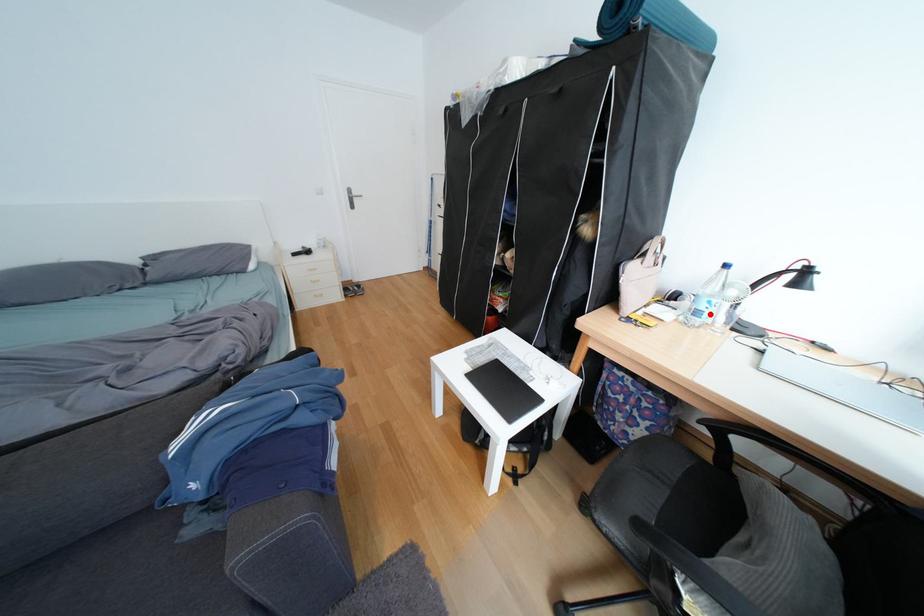
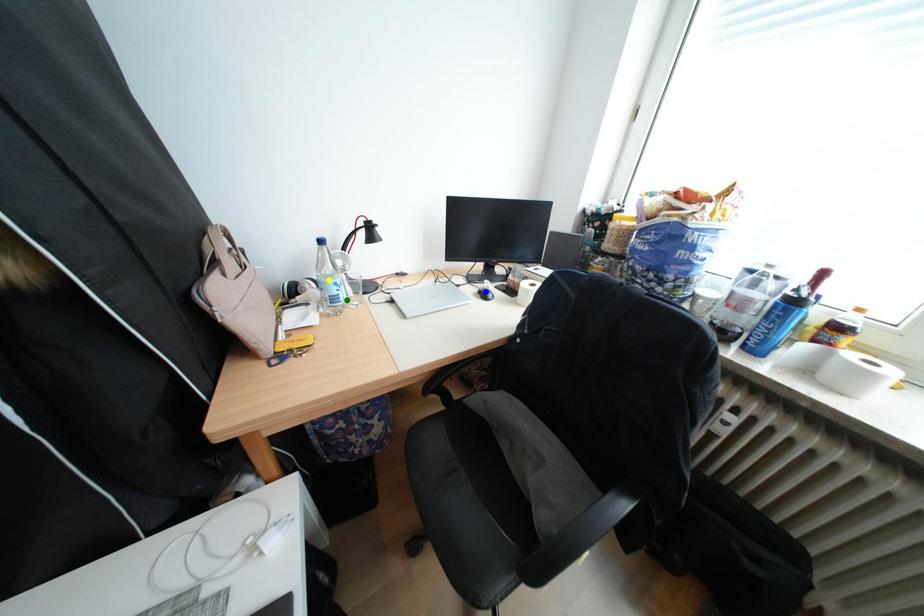
Question: I am providing you with two images of the same scene from different viewpoints. A red point is marked on the first image. You are given multiple points on the second image. Can you choose the point in image 2 that corresponds to the point in image 1?

Choices:
 (A) blue point
 (B) green point
 (C) yellow point

Answer: (B)